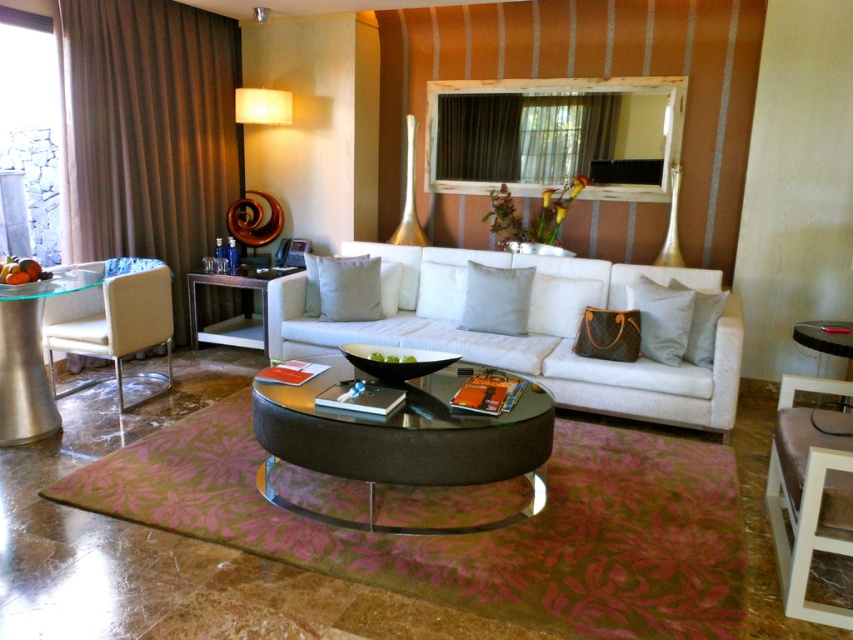
Question: Is beige leather chair at left to the left of white fabric cushion at center from the viewer's perspective?

Choices:
 (A) yes
 (B) no

Answer: (A)

Question: Which of the following is the closest to the observer?

Choices:
 (A) white wood armchair at lower right
 (B) beige fabric pillow at center
 (C) white fabric couch at center

Answer: (A)

Question: Which object appears farthest from the camera in this image?

Choices:
 (A) matte black side table at center
 (B) beige leather chair at left
 (C) beige fabric pillow at center

Answer: (A)

Question: In this image, where is white fabric cushion at center located relative to beige fabric pillow at center?

Choices:
 (A) right
 (B) left

Answer: (A)

Question: Can you confirm if glass/metallic round table at center is wider than white wood armchair at lower right?

Choices:
 (A) no
 (B) yes

Answer: (B)

Question: Considering the real-world distances, which object is farthest from the white fabric couch at center?

Choices:
 (A) white wood armchair at lower right
 (B) leather cushion at center
 (C) beige leather chair at left
 (D) gray fabric pillow at center

Answer: (A)